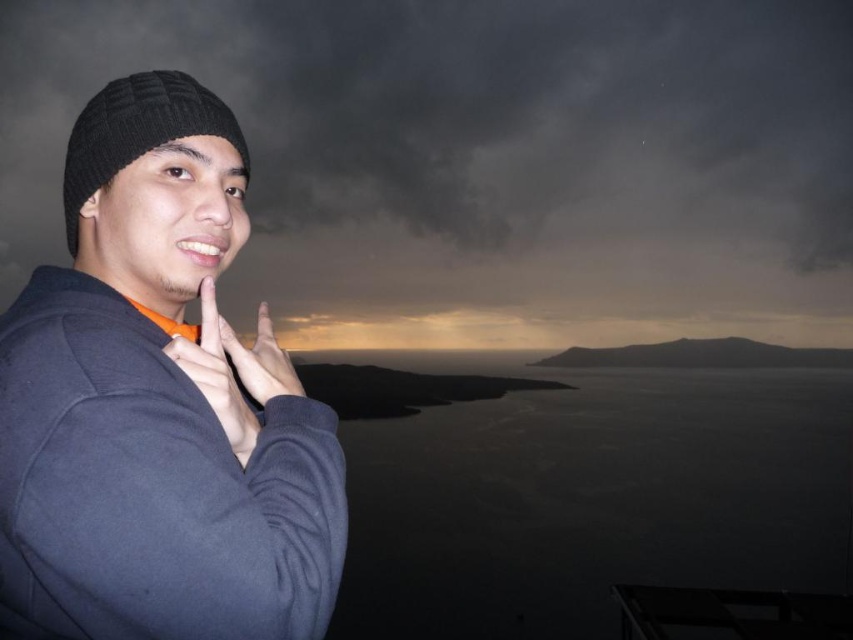
You are a photographer setting up for a portrait shoot in the described scene. You need to place two knitted hats, the knitted wool beanie at left and the black knitted hat at left, on a shelf behind the subject. The shelf is only 12 inches wide. Will both hats fit side by side on the shelf without overlapping?

The knitted wool beanie at left is 13.14 inches from the black knitted hat at left, which means the total width required for both hats would exceed the 12 inch shelf width. Therefore, they cannot fit side by side without overlapping.

You are a photographer trying to capture the scene with a camera. You notice the dark matte water at lower right and the matte black hand at center. Which object in the scene is wider?

The dark matte water at lower right might be wider than matte black hand at center.

You are a fashion stylist helping a client choose between two hats for an outdoor evening event. The client has the knitted wool beanie at left and the black knitted hat at left. Which hat has a wider brim?

The knitted wool beanie at left has a wider brim than the black knitted hat at left because its width surpasses the latter.